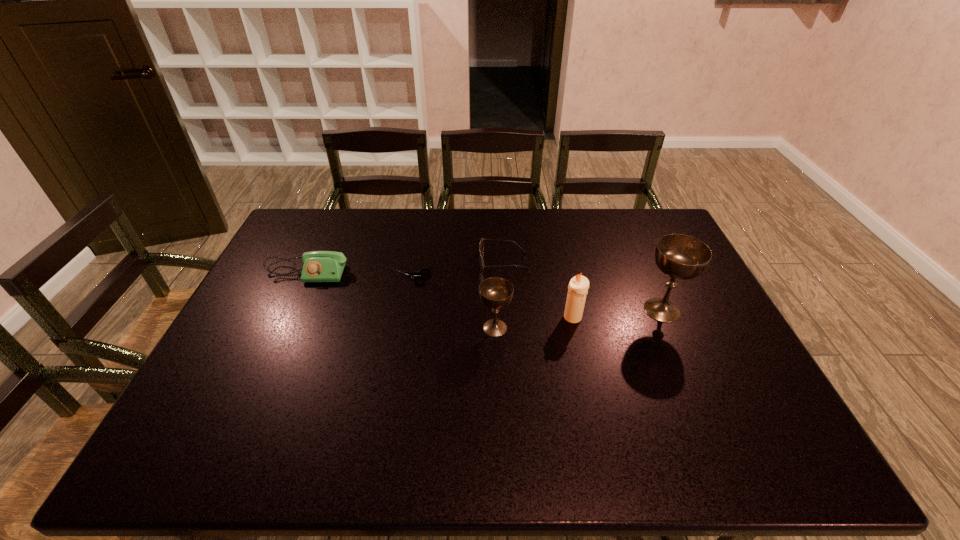
This screenshot has width=960, height=540. Identify the location of the left chalice. (495, 292).

At what (x,y) coordinates should I click in order to perform the action: click on the rightmost object. Please return your answer as a coordinate pair (x, y). Image resolution: width=960 pixels, height=540 pixels. Looking at the image, I should click on (683, 257).

This screenshot has height=540, width=960. Find the location of `the tallest object`. the tallest object is located at coordinates (683, 257).

This screenshot has width=960, height=540. What are the coordinates of `the second shortest object` in the screenshot? It's located at (481, 248).

The width and height of the screenshot is (960, 540). Find the location of `the second object from left to right`. the second object from left to right is located at coordinates (415, 275).

Where is `the shortest object`? Image resolution: width=960 pixels, height=540 pixels. the shortest object is located at coordinates (415, 275).

I want to click on the third shortest object, so click(319, 266).

The height and width of the screenshot is (540, 960). Identify the location of the leftmost object. (319, 266).

The image size is (960, 540). Identify the location of candle. (578, 286).

The width and height of the screenshot is (960, 540). Identify the location of vacant space located on the right of the left chalice. (639, 328).